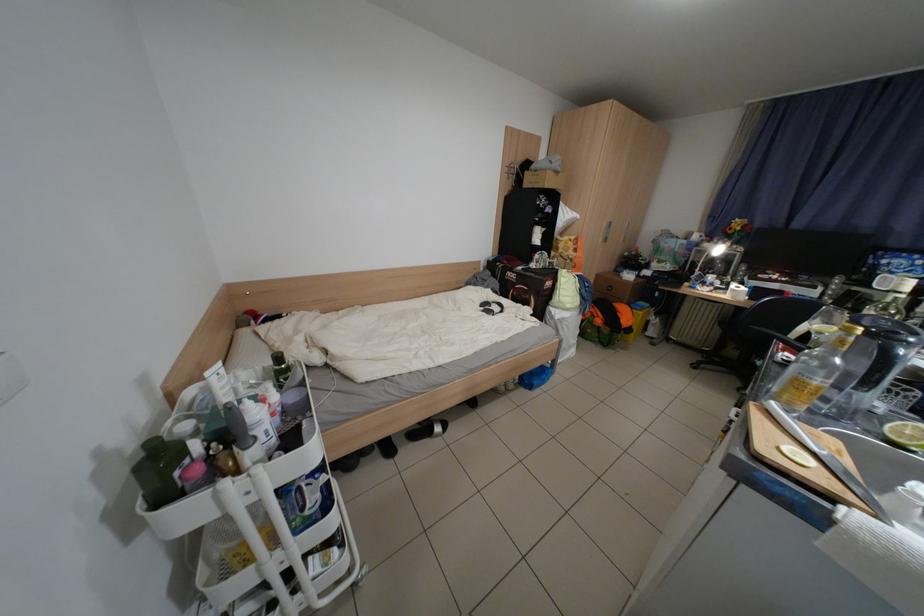
Describe the element at coordinates (827, 460) in the screenshot. I see `a kitchen knife` at that location.